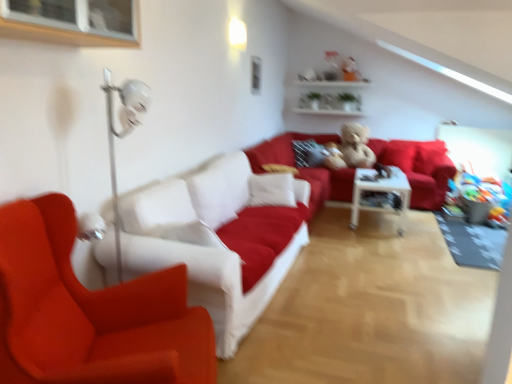
Question: Is matte red chair at left further to the viewer compared to white glossy shelves at upper center?

Choices:
 (A) yes
 (B) no

Answer: (B)

Question: Is matte red chair at left outside of white glossy shelves at upper center?

Choices:
 (A) no
 (B) yes

Answer: (B)

Question: Is the position of matte red chair at left less distant than that of white glossy shelves at upper center?

Choices:
 (A) yes
 (B) no

Answer: (A)

Question: Can you confirm if matte red chair at left is taller than white glossy shelves at upper center?

Choices:
 (A) no
 (B) yes

Answer: (B)

Question: Considering the relative positions of matte red chair at left and white glossy shelves at upper center in the image provided, is matte red chair at left to the left of white glossy shelves at upper center from the viewer's perspective?

Choices:
 (A) yes
 (B) no

Answer: (A)

Question: Looking at the image, does white glossy shelves at upper center seem bigger or smaller compared to velvet red pillow at center?

Choices:
 (A) big
 (B) small

Answer: (A)

Question: In the image, is white glossy shelves at upper center positioned in front of or behind velvet red pillow at center?

Choices:
 (A) front
 (B) behind

Answer: (B)

Question: From the image's perspective, relative to velvet red pillow at center, is white glossy shelves at upper center above or below?

Choices:
 (A) above
 (B) below

Answer: (A)

Question: Considering the positions of white glossy shelves at upper center and velvet red pillow at center in the image, is white glossy shelves at upper center wider or thinner than velvet red pillow at center?

Choices:
 (A) wide
 (B) thin

Answer: (B)

Question: Is velvet red couch at center, placed as the second studio couch when sorted from front to back, inside or outside of white glossy table at center?

Choices:
 (A) inside
 (B) outside

Answer: (B)

Question: Is velvet red couch at center, which appears as the first studio couch when viewed from the back, bigger or smaller than white glossy table at center?

Choices:
 (A) big
 (B) small

Answer: (A)

Question: Is velvet red couch at center, positioned as the 1th studio couch in right-to-left order, in front of or behind white glossy table at center in the image?

Choices:
 (A) behind
 (B) front

Answer: (A)

Question: Is point (434, 157) closer or farther from the camera than point (364, 208)?

Choices:
 (A) closer
 (B) farther

Answer: (B)

Question: From a real-world perspective, is white glossy table at center physically located above or below fluffy beige teddy bear at center?

Choices:
 (A) above
 (B) below

Answer: (B)

Question: Do you think white glossy table at center is within fluffy beige teddy bear at center, or outside of it?

Choices:
 (A) inside
 (B) outside

Answer: (B)